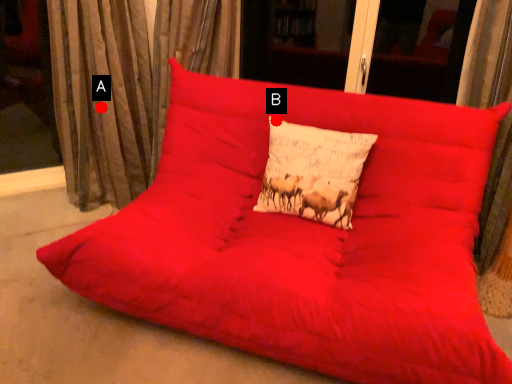
Question: Two points are circled on the image, labeled by A and B beside each circle. Which point is further to the camera?

Choices:
 (A) A is further
 (B) B is further

Answer: (A)